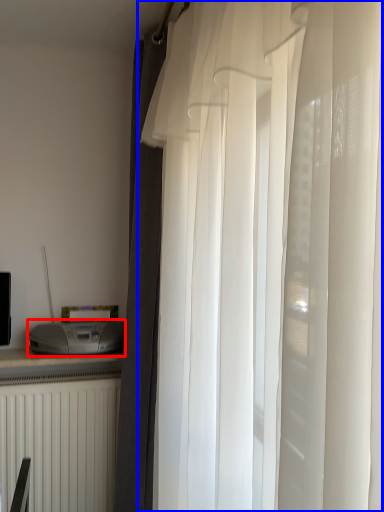
Question: Which object is closer to the camera taking this photo, appliance (highlighted by a red box) or curtain (highlighted by a blue box)?

Choices:
 (A) appliance
 (B) curtain

Answer: (B)